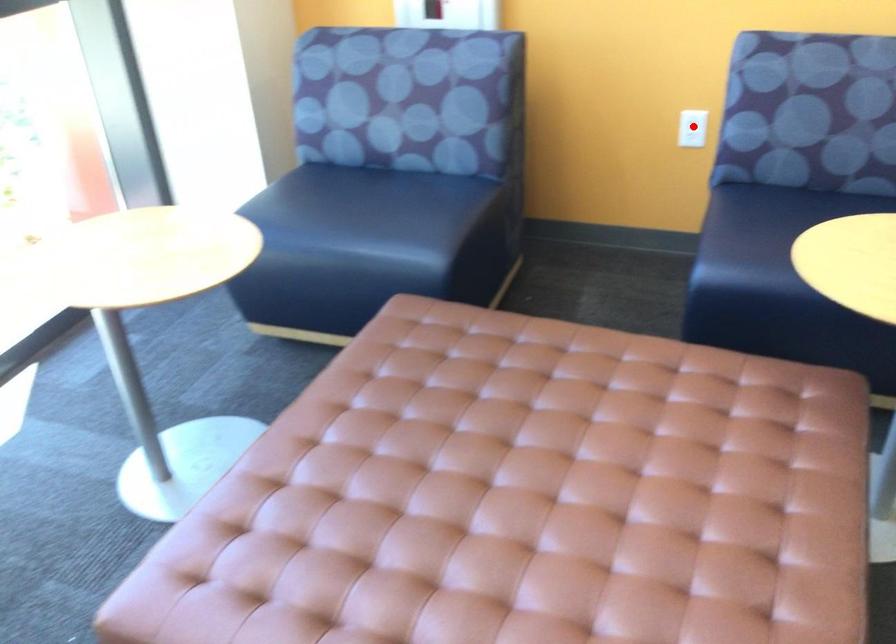
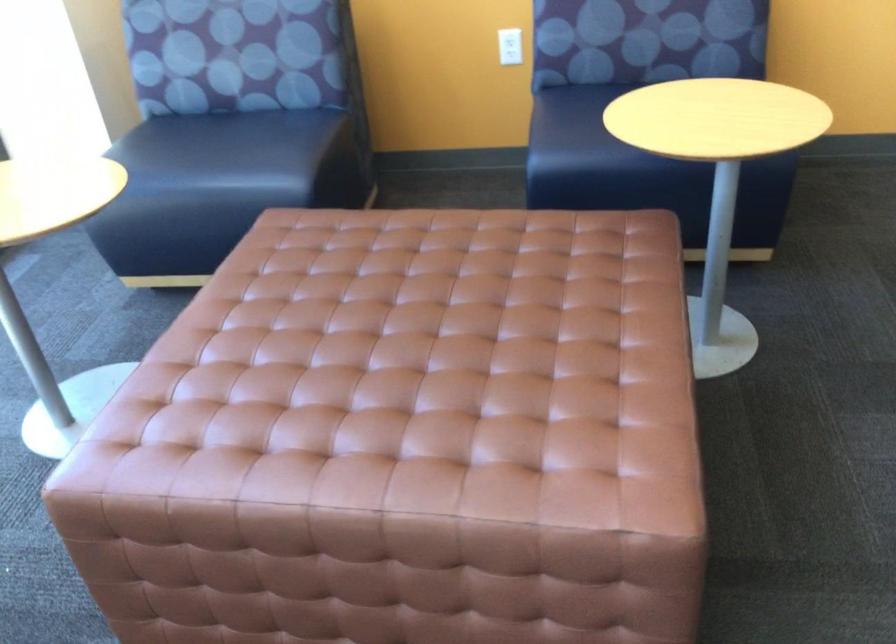
Question: I am providing you with two images of the same scene from different viewpoints. A red point is shown in image1. For the corresponding object point in image2, is it positioned nearer or farther from the camera?

Choices:
 (A) Nearer
 (B) Farther

Answer: (B)